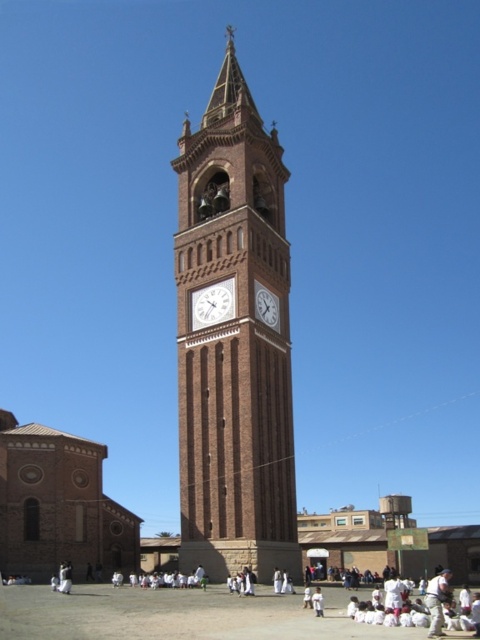
You are standing in front of the clock tower and want to locate the white glossy clock at center. Where should you look?

You should look at point (x=213, y=305) to find the white glossy clock at center.

You are an architect reviewing the blueprint of a clock tower. You notice two central elements labeled as the white glossy clock at center and the brick clock tower at center. According to the design, which one is positioned to the left?

The white glossy clock at center is to the left of the brick clock tower at center, so the white glossy clock at center is positioned to the left.

You are standing in front of the brick clock tower at center and looking up at the white glossy clock at center. Which object is closer to your eyes?

The white glossy clock at center is closer to the viewer than the brick clock tower at center, so it is closer to your eyes.